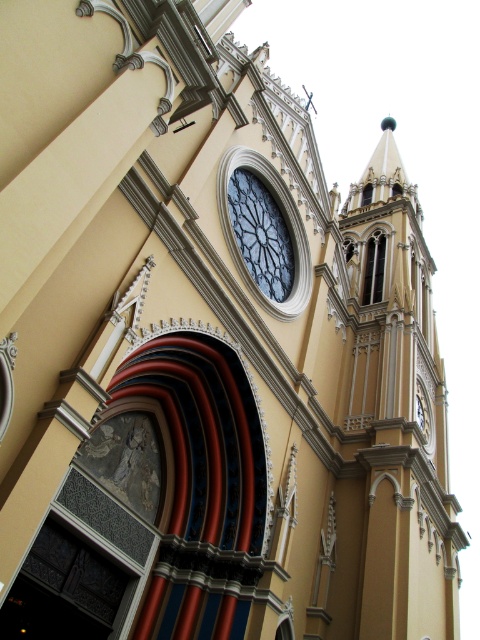
You are standing in front of the church facade and want to take a photo of the dark glass clock at center without the gold polished stone tower at upper right blocking it. Is this possible?

The gold polished stone tower at upper right is in front of the dark glass clock at center, so it will block the view. Move to a position where the tower is not in front of the clock to take the photo.

You are an architect examining the church facade. You notice the gold polished stone tower at upper right and the dark glass clock at center. Which object is located to the right of the other?

The gold polished stone tower at upper right is positioned on the right side of dark glass clock at center.

You are an architect assessing the church facade. You need to determine which object has a greater width between the gold polished stone tower at upper right and the dark glass clock at center. Based on the provided information, which one is wider?

The gold polished stone tower at upper right is wider than the dark glass clock at center because its width surpasses that of the dark glass clock at center.